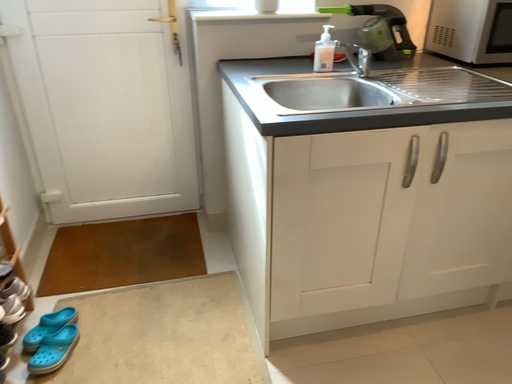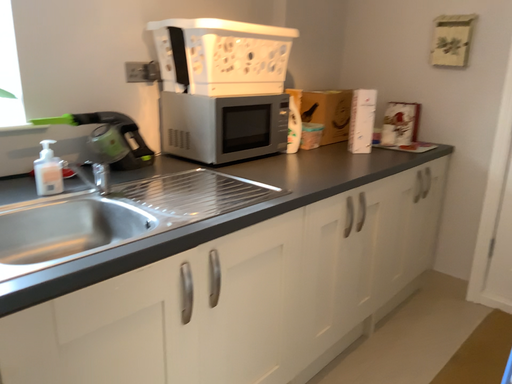
Question: How did the camera likely rotate when shooting the video?

Choices:
 (A) rotated right
 (B) rotated left

Answer: (A)